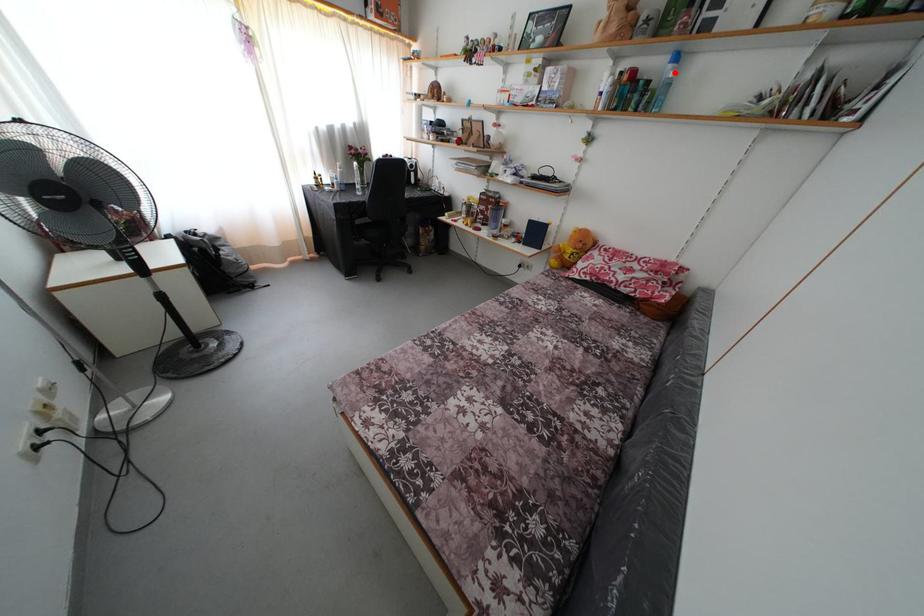
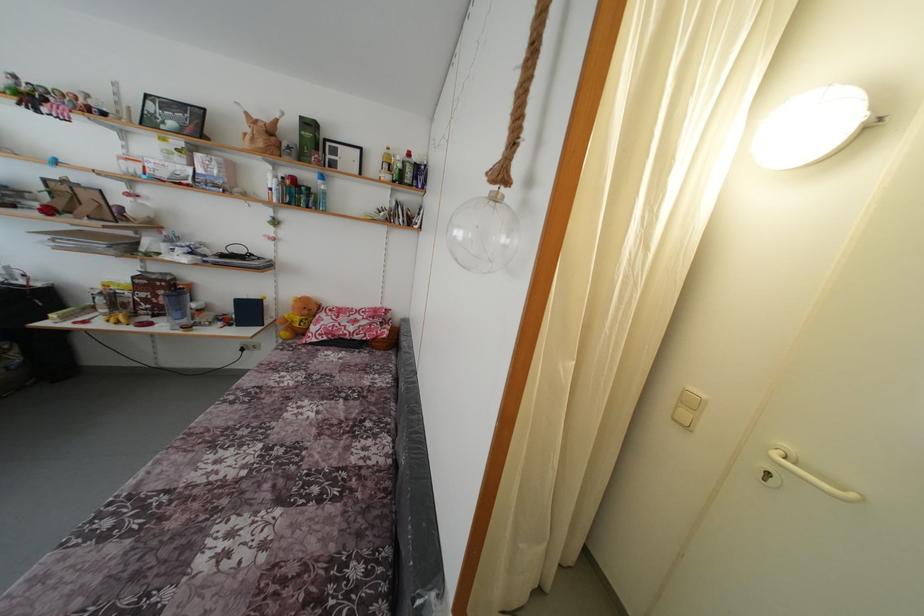
Where in the second image is the point corresponding to the highlighted location from the first image?

(324, 188)